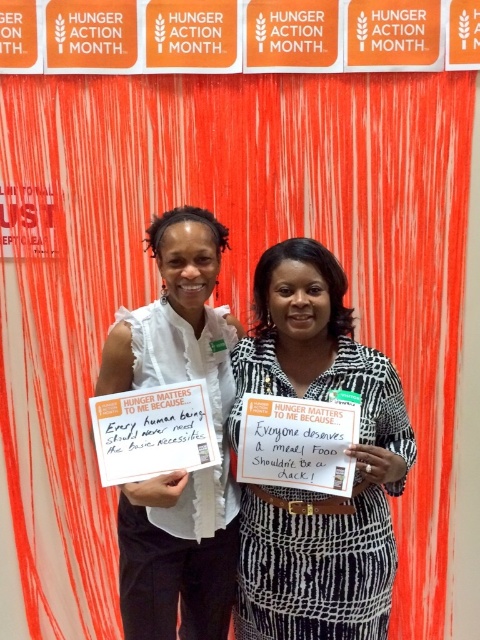
Question: Is white printed signboard at center bigger than white paper sign at center?

Choices:
 (A) no
 (B) yes

Answer: (A)

Question: Which of the following is the closest to the observer?

Choices:
 (A) (162, 342)
 (B) (284, 273)

Answer: (B)

Question: Which object appears farthest from the camera in this image?

Choices:
 (A) white paper sign at center
 (B) white printed signboard at center

Answer: (A)

Question: Does white printed signboard at center appear on the left side of white paper sign at center?

Choices:
 (A) no
 (B) yes

Answer: (A)

Question: Can you confirm if white printed signboard at center is bigger than white paper sign at center?

Choices:
 (A) no
 (B) yes

Answer: (A)